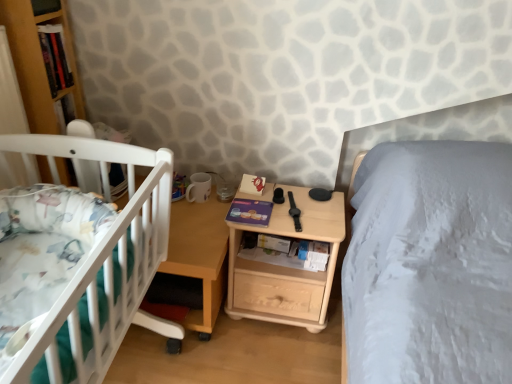
The height and width of the screenshot is (384, 512). I want to click on white plastic crib at left, so click(99, 265).

What do you see at coordinates (199, 258) in the screenshot? I see `wooden table at center` at bounding box center [199, 258].

I want to click on hardcover book at upper left, the 1th book positioned from the left, so click(55, 57).

Is hardcover book at upper left, the second book from the bottom, facing away from wooden table at center?

That's not correct — hardcover book at upper left, the second book from the bottom, is not looking away from wooden table at center.

From the image's perspective, does hardcover book at upper left, the first book positioned from the top, appear lower than wooden table at center?

Actually, hardcover book at upper left, the first book positioned from the top, appears above wooden table at center in the image.

How many degrees apart are the facing directions of hardcover book at upper left, acting as the second book starting from the right, and wooden table at center?

hardcover book at upper left, acting as the second book starting from the right, and wooden table at center are facing 85.5 degrees away from each other.

Is hardcover book at upper left, the first book positioned from the top, outside of wooden table at center?

Yes, hardcover book at upper left, the first book positioned from the top, is located beyond the bounds of wooden table at center.

In terms of width, does wooden table at center look wider or thinner when compared to matte purple book at center, which is the first book from right to left?

wooden table at center is wider than matte purple book at center, which is the first book from right to left.

Is wooden table at center at the left side of matte purple book at center, arranged as the second book when viewed from the top?

Yes.

Does point (193, 224) appear closer or farther from the camera than point (234, 203)?

Point (193, 224) appears to be closer to the viewer than point (234, 203).

Could you measure the distance between wooden table at center and matte purple book at center, arranged as the second book when viewed from the top?

8.14 inches.

Who is bigger, white plastic crib at left or natural wood nightstand at center?

natural wood nightstand at center.

From the image's perspective, between white plastic crib at left and natural wood nightstand at center, which one is located above?

white plastic crib at left, from the image's perspective.

How far apart are white plastic crib at left and natural wood nightstand at center?

20.04 inches.

Where is `infant bed that is above the natural wood nightstand at center (from a real-world perspective)`? The height and width of the screenshot is (384, 512). infant bed that is above the natural wood nightstand at center (from a real-world perspective) is located at coordinates 99,265.

From their relative heights in the image, would you say natural wood nightstand at center is taller or shorter than hardcover book at upper left, acting as the second book starting from the right?

Considering their sizes, natural wood nightstand at center has more height than hardcover book at upper left, acting as the second book starting from the right.

Is point (248, 268) more distant than point (56, 93)?

Yes, it is.

From a real-world perspective, between natural wood nightstand at center and hardcover book at upper left, the first book positioned from the top, who is vertically lower?

natural wood nightstand at center, from a real-world perspective.

In terms of size, does natural wood nightstand at center appear bigger or smaller than hardcover book at upper left, the 1th book positioned from the left?

Considering their sizes, natural wood nightstand at center takes up more space than hardcover book at upper left, the 1th book positioned from the left.

At what (x,y) coordinates should I click in order to perform the action: click on table that appears on the right of white plastic crib at left. Please return your answer as a coordinate pair (x, y). Looking at the image, I should click on (199, 258).

In the scene shown: Which object is positioned more to the left, white plastic crib at left or wooden table at center?

From the viewer's perspective, white plastic crib at left appears more on the left side.

Considering the sizes of objects white plastic crib at left and wooden table at center in the image provided, who is shorter, white plastic crib at left or wooden table at center?

With less height is white plastic crib at left.

Is white plastic crib at left not within wooden table at center?

white plastic crib at left is positioned outside wooden table at center.

Which of these two, white plastic crib at left or matte purple book at center, the 1th book in the bottom-to-top sequence, is thinner?

matte purple book at center, the 1th book in the bottom-to-top sequence.

From the image's perspective, is white plastic crib at left under matte purple book at center, which appears as the second book when viewed from the left?

Yes.

How distant is white plastic crib at left from matte purple book at center, the 1th book in the bottom-to-top sequence?

white plastic crib at left is 19.99 inches from matte purple book at center, the 1th book in the bottom-to-top sequence.

Considering the positions of objects white plastic crib at left and matte purple book at center, which is the first book from right to left, in the image provided, who is in front, white plastic crib at left or matte purple book at center, which is the first book from right to left,?

white plastic crib at left is closer to the camera.

Does white plastic crib at left lie behind hardcover book at upper left, acting as the second book starting from the right?

No, white plastic crib at left is closer to the viewer.

From a real-world perspective, which is physically below, white plastic crib at left or hardcover book at upper left, the second book from the bottom?

From a 3D spatial view, white plastic crib at left is below.

Is white plastic crib at left positioned far away from hardcover book at upper left, the 1th book positioned from the left?

Actually, white plastic crib at left and hardcover book at upper left, the 1th book positioned from the left, are a little close together.

Can you tell me how much white plastic crib at left and hardcover book at upper left, the 1th book positioned from the left, differ in facing direction?

4.76 degrees.

This screenshot has width=512, height=384. I want to click on the 1st book behind the wooden table at center, counting from the anchor's position, so click(x=55, y=57).

Where is `book on the right side of wooden table at center`? Image resolution: width=512 pixels, height=384 pixels. book on the right side of wooden table at center is located at coordinates (250, 212).

When comparing their distances from matte purple book at center, the 1th book in the bottom-to-top sequence, does natural wood nightstand at center or hardcover book at upper left, the first book positioned from the top, seem further?

Among the two, hardcover book at upper left, the first book positioned from the top, is located further to matte purple book at center, the 1th book in the bottom-to-top sequence.

When comparing their distances from hardcover book at upper left, the second book from the bottom, does natural wood nightstand at center or wooden table at center seem closer?

Based on the image, wooden table at center appears to be nearer to hardcover book at upper left, the second book from the bottom.

Considering their positions, is natural wood nightstand at center positioned further to matte purple book at center, arranged as the second book when viewed from the top, than wooden table at center?

Based on the image, natural wood nightstand at center appears to be further to matte purple book at center, arranged as the second book when viewed from the top.

When comparing their distances from hardcover book at upper left, the first book positioned from the top, does natural wood nightstand at center or white plastic crib at left seem closer?

The object closer to hardcover book at upper left, the first book positioned from the top, is white plastic crib at left.

Estimate the real-world distances between objects in this image. Which object is further from white plastic crib at left, matte purple book at center, which appears as the second book when viewed from the left, or natural wood nightstand at center?

The object further to white plastic crib at left is natural wood nightstand at center.

Based on their spatial positions, is hardcover book at upper left, the 1th book positioned from the left, or natural wood nightstand at center further from wooden table at center?

The object further to wooden table at center is hardcover book at upper left, the 1th book positioned from the left.

Which object lies further to the anchor point white plastic crib at left, matte purple book at center, which appears as the second book when viewed from the left, or wooden table at center?

The object further to white plastic crib at left is matte purple book at center, which appears as the second book when viewed from the left.

Which object lies further to the anchor point hardcover book at upper left, acting as the second book starting from the right, wooden table at center or natural wood nightstand at center?

Among the two, natural wood nightstand at center is located further to hardcover book at upper left, acting as the second book starting from the right.

The height and width of the screenshot is (384, 512). I want to click on table between white plastic crib at left and matte purple book at center, which is the first book from right to left, from front to back, so click(199, 258).

Where is `table positioned between white plastic crib at left and natural wood nightstand at center from near to far`? The width and height of the screenshot is (512, 384). table positioned between white plastic crib at left and natural wood nightstand at center from near to far is located at coordinates (199, 258).

Locate an element on the screen. This screenshot has height=384, width=512. book between hardcover book at upper left, the 1th book positioned from the left, and natural wood nightstand at center is located at coordinates (250, 212).

Image resolution: width=512 pixels, height=384 pixels. In order to click on nightstand between white plastic crib at left and matte purple book at center, arranged as the second book when viewed from the top, along the z-axis in this screenshot , I will do `click(286, 267)`.